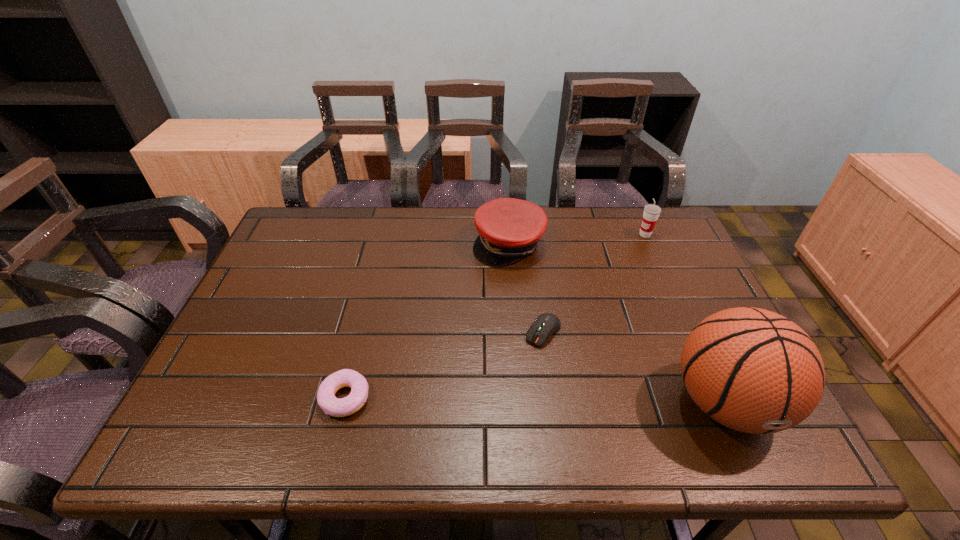
You are a GUI agent. You are given a task and a screenshot of the screen. Output one action in this format:
    pyautogui.click(x=<x>, y=<y>)
    Task: Click on the vacant region located on the front-facing side of the cap
    
    Given the screenshot: What is the action you would take?
    pyautogui.click(x=520, y=299)

Locate an element on the screen. vacant space located 0.250m on the side of the fourth shortest object with the logo is located at coordinates pos(605,281).

The width and height of the screenshot is (960, 540). Identify the location of vacant point located 0.080m on the side of the fourth shortest object with the logo. (631, 251).

The image size is (960, 540). I want to click on vacant space situated 0.270m on the side of the fourth shortest object with the logo, so click(601, 285).

Identify the location of cap located in the far edge section of the desktop. click(x=509, y=229).

You are a GUI agent. You are given a task and a screenshot of the screen. Output one action in this format:
    pyautogui.click(x=<x>, y=<y>)
    Task: Click on the cup situated at the far edge
    This screenshot has width=960, height=540.
    Given the screenshot: What is the action you would take?
    pyautogui.click(x=651, y=212)

Where is `doughnut that is at the near edge`? Image resolution: width=960 pixels, height=540 pixels. doughnut that is at the near edge is located at coordinates (326, 399).

You are a GUI agent. You are given a task and a screenshot of the screen. Output one action in this format:
    pyautogui.click(x=<x>, y=<y>)
    Task: Click on the basketball at the near edge
    
    Given the screenshot: What is the action you would take?
    pyautogui.click(x=755, y=371)

At what (x,y) coordinates should I click in order to perform the action: click on basketball at the right edge. Please return your answer as a coordinate pair (x, y). The height and width of the screenshot is (540, 960). Looking at the image, I should click on (755, 371).

The width and height of the screenshot is (960, 540). Find the location of `cup at the right edge`. cup at the right edge is located at coordinates (651, 212).